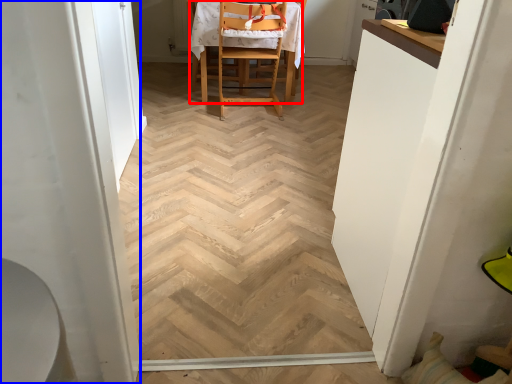
Question: Among these objects, which one is nearest to the camera, chair (highlighted by a red box) or screen door (highlighted by a blue box)?

Choices:
 (A) chair
 (B) screen door

Answer: (B)